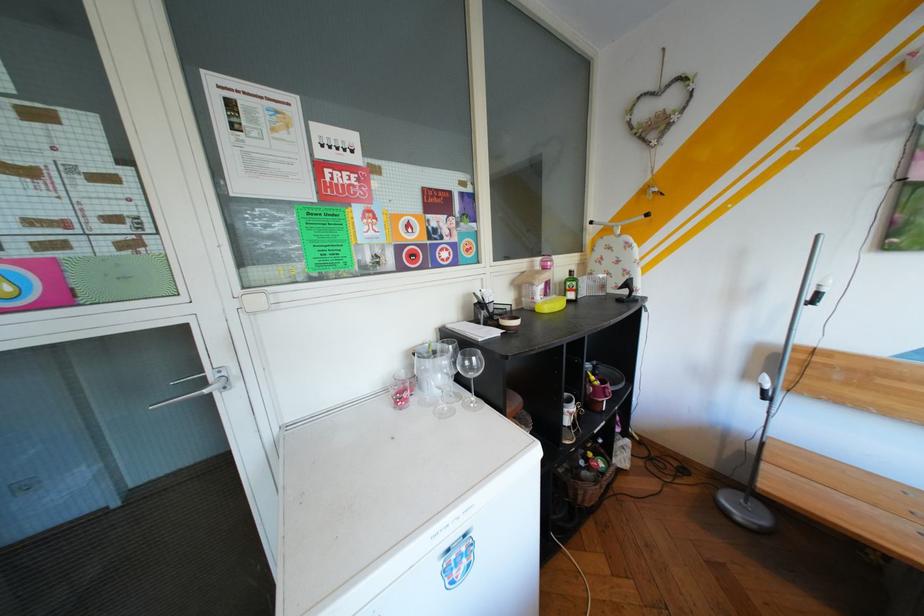
Find where to lift the brown glass bottle. Please return your answer as a coordinate pair (x, y).

(570, 284)